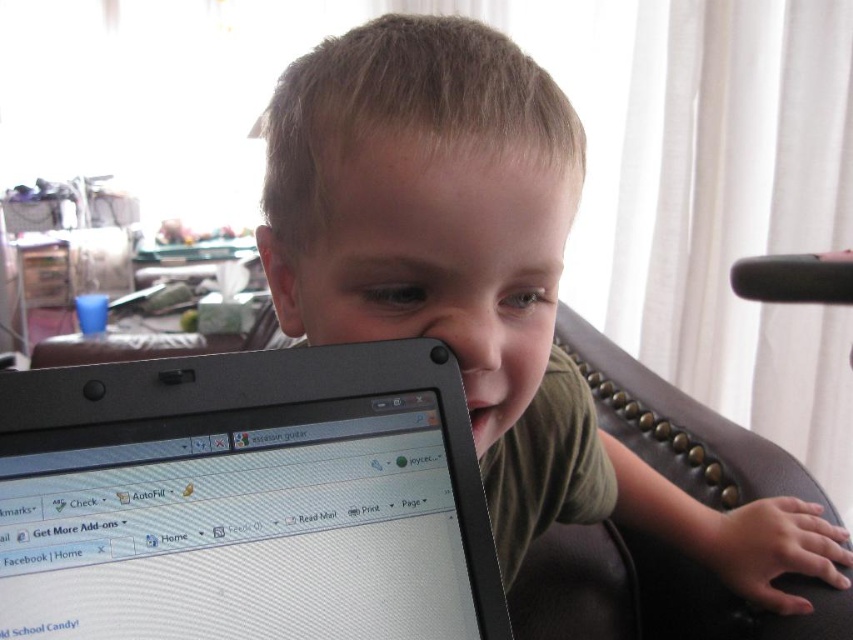
Does black plastic laptop at center have a lesser width compared to matte black laptop at center?

Yes, black plastic laptop at center is thinner than matte black laptop at center.

Is black plastic laptop at center smaller than matte black laptop at center?

Yes.

Is point (486, 554) farther from viewer compared to point (553, 250)?

No.

What are the coordinates of `black plastic laptop at center` in the screenshot? It's located at (245, 499).